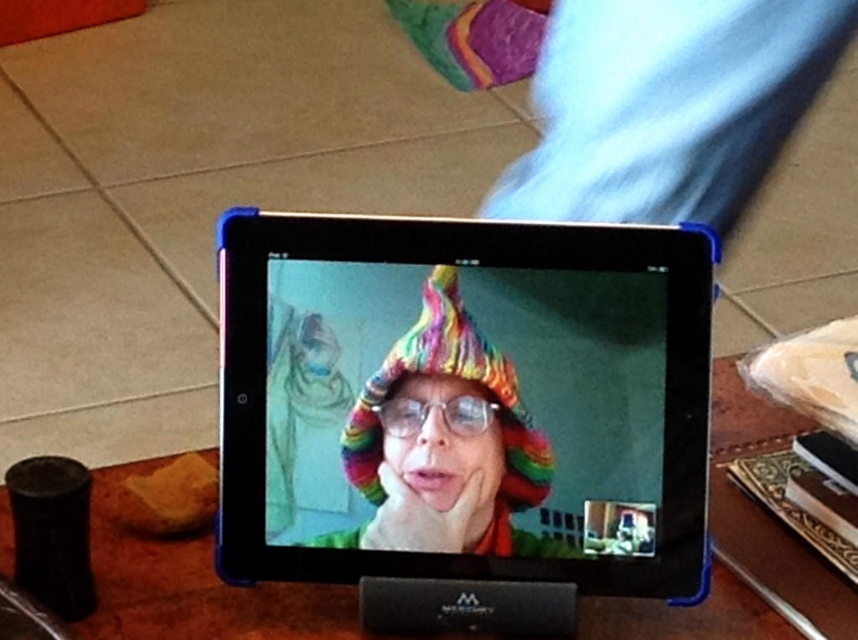
Question: Can you confirm if wooden table at center is bigger than rainbow knitted hat at center?

Choices:
 (A) yes
 (B) no

Answer: (A)

Question: Among these points, which one is farthest from the camera?

Choices:
 (A) click(x=420, y=419)
 (B) click(x=728, y=605)

Answer: (B)

Question: Is wooden table at center bigger than clear plastic glasses at center?

Choices:
 (A) no
 (B) yes

Answer: (B)

Question: Which is farther from the clear plastic glasses at center?

Choices:
 (A) black plastic tablet at center
 (B) wooden table at center
 (C) rainbow knitted hat at center

Answer: (B)

Question: Estimate the real-world distances between objects in this image. Which object is closer to the wooden table at center?

Choices:
 (A) clear plastic glasses at center
 (B) black plastic tablet at center

Answer: (B)

Question: Does wooden table at center have a lesser width compared to clear plastic glasses at center?

Choices:
 (A) yes
 (B) no

Answer: (B)